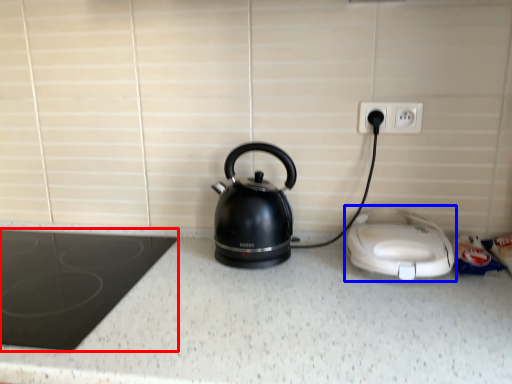
Question: Which object is closer to the camera taking this photo, home appliance (highlighted by a red box) or home appliance (highlighted by a blue box)?

Choices:
 (A) home appliance
 (B) home appliance

Answer: (A)